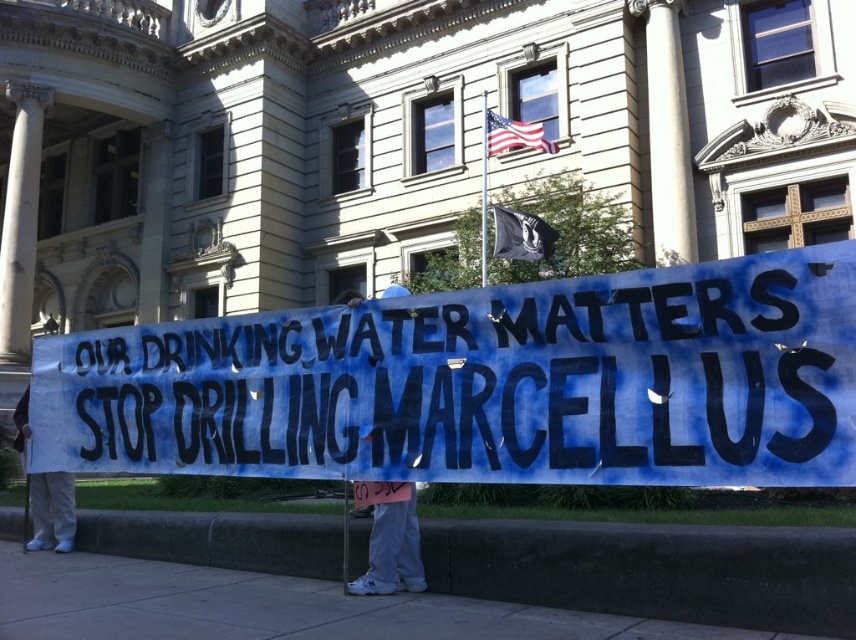
Is white marble column at left below white fabric sign at lower left?

Incorrect, white marble column at left is not positioned below white fabric sign at lower left.

The height and width of the screenshot is (640, 856). What do you see at coordinates (21, 221) in the screenshot?
I see `white marble column at left` at bounding box center [21, 221].

Where is `white marble column at left`? This screenshot has height=640, width=856. white marble column at left is located at coordinates (21, 221).

From the picture: Does white stone column at center appear over white marble column at left?

Indeed, white stone column at center is positioned over white marble column at left.

Which is behind, point (667, 83) or point (15, 173)?

The point (15, 173) is more distant.

In order to click on white stone column at center in this screenshot , I will do `click(667, 132)`.

Which is below, blue painted sign at center or white fabric banner at lower center?

blue painted sign at center

Which is more to the right, blue painted sign at center or white fabric banner at lower center?

From the viewer's perspective, blue painted sign at center appears more on the right side.

From the picture: Who is more forward, (100,422) or (393,528)?

Point (393,528) is more forward.

Where is `blue painted sign at center`? blue painted sign at center is located at coordinates (484, 384).